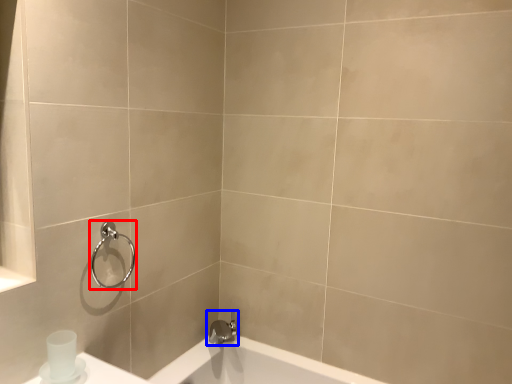
Question: Among these objects, which one is nearest to the camera, shower (highlighted by a red box) or tap (highlighted by a blue box)?

Choices:
 (A) shower
 (B) tap

Answer: (A)